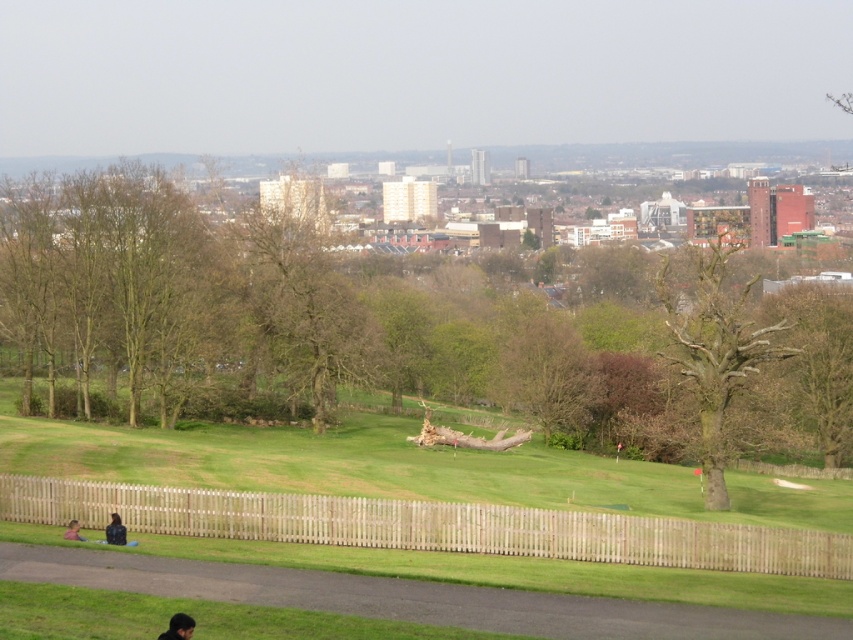
Question: Which object is closer to the camera taking this photo?

Choices:
 (A) green grass at center
 (B) dark brown hair at lower left
 (C) dark blue jacket at lower left

Answer: (B)

Question: Does dark brown hair at lower left appear over dark blue jacket at lower left?

Choices:
 (A) no
 (B) yes

Answer: (B)

Question: Does brown wood tree at center have a greater width compared to dark blue shirt at lower left?

Choices:
 (A) no
 (B) yes

Answer: (B)

Question: Which of the following is the closest to the observer?

Choices:
 (A) dark blue jacket at lower left
 (B) green grass at center

Answer: (B)

Question: Based on their relative distances, which object is nearer to the dark blue shirt at lower left?

Choices:
 (A) green grass at center
 (B) brown rough textured tree at right
 (C) dark blue jacket at lower left

Answer: (C)

Question: Does brown wood tree at center have a lesser width compared to dark blue shirt at lower left?

Choices:
 (A) no
 (B) yes

Answer: (A)